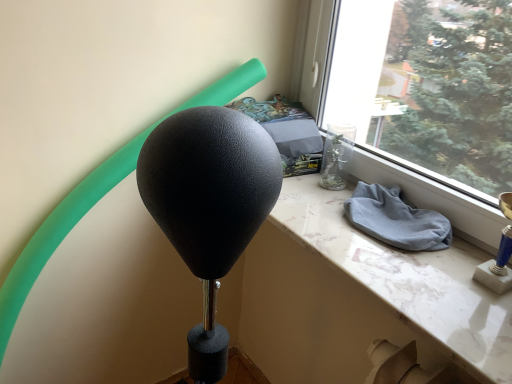
You are a GUI agent. You are given a task and a screenshot of the screen. Output one action in this format:
    pyautogui.click(x=<x>, y=<y>)
    Task: Click on the free location in front of gray cotton cloth at window sill
    The width and height of the screenshot is (512, 384).
    Given the screenshot: What is the action you would take?
    click(x=417, y=280)